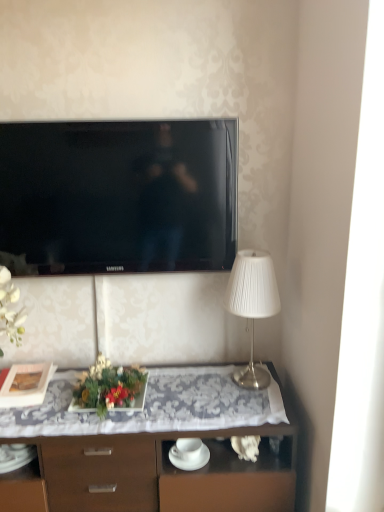
Question: Is matte black picture frame at left further to camera compared to wooden desk at center?

Choices:
 (A) no
 (B) yes

Answer: (B)

Question: Can you confirm if matte black picture frame at left is taller than wooden desk at center?

Choices:
 (A) no
 (B) yes

Answer: (A)

Question: Can you confirm if matte black picture frame at left is wider than wooden desk at center?

Choices:
 (A) no
 (B) yes

Answer: (A)

Question: From the image's perspective, would you say matte black picture frame at left is positioned over wooden desk at center?

Choices:
 (A) yes
 (B) no

Answer: (A)

Question: Is matte black picture frame at left far from wooden desk at center?

Choices:
 (A) yes
 (B) no

Answer: (B)

Question: Is matte black picture frame at left facing towards wooden desk at center?

Choices:
 (A) yes
 (B) no

Answer: (B)

Question: Does matte black picture frame at left have a larger size compared to black glossy tv at upper center?

Choices:
 (A) no
 (B) yes

Answer: (A)

Question: Is matte black picture frame at left smaller than black glossy tv at upper center?

Choices:
 (A) yes
 (B) no

Answer: (A)

Question: Could you tell me if matte black picture frame at left is facing black glossy tv at upper center?

Choices:
 (A) yes
 (B) no

Answer: (B)

Question: Is matte black picture frame at left closer to camera compared to black glossy tv at upper center?

Choices:
 (A) yes
 (B) no

Answer: (B)

Question: Is matte black picture frame at left surrounding black glossy tv at upper center?

Choices:
 (A) no
 (B) yes

Answer: (A)

Question: Can you confirm if matte black picture frame at left is taller than black glossy tv at upper center?

Choices:
 (A) no
 (B) yes

Answer: (A)

Question: Can you confirm if white pleated fabric lampshade at right is thinner than wooden desk at center?

Choices:
 (A) no
 (B) yes

Answer: (B)